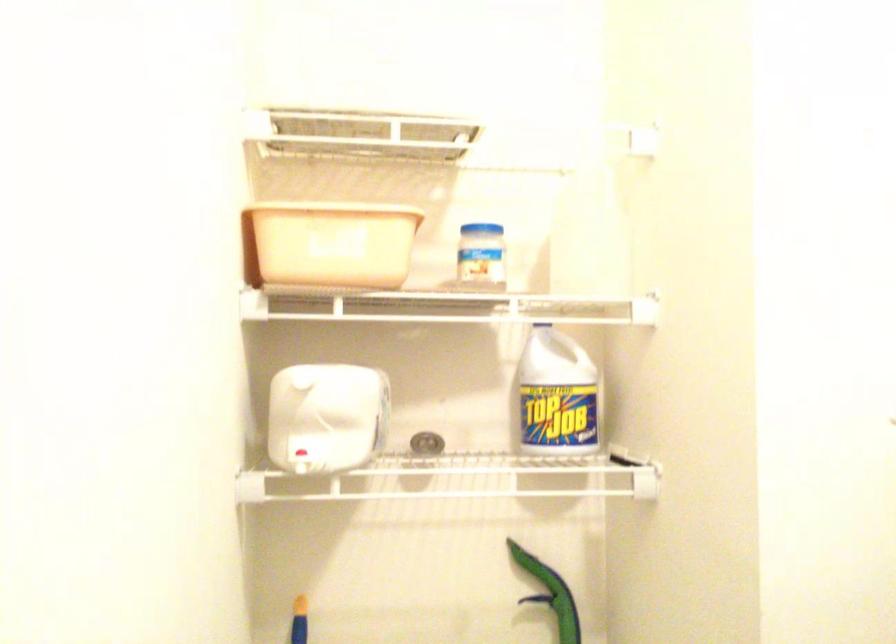
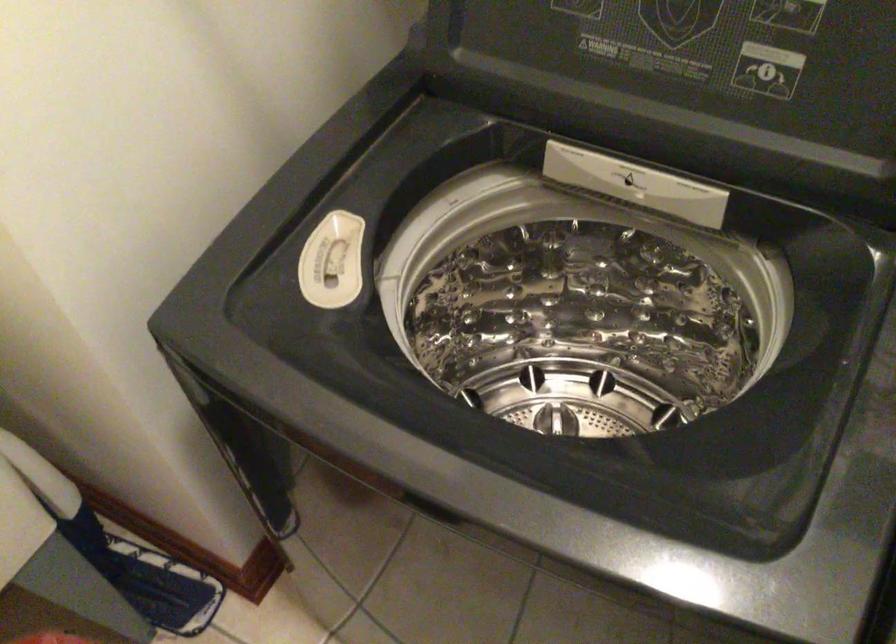
Based on the continuous images, in which direction is the camera rotating?

The camera's rotation is toward right-down.